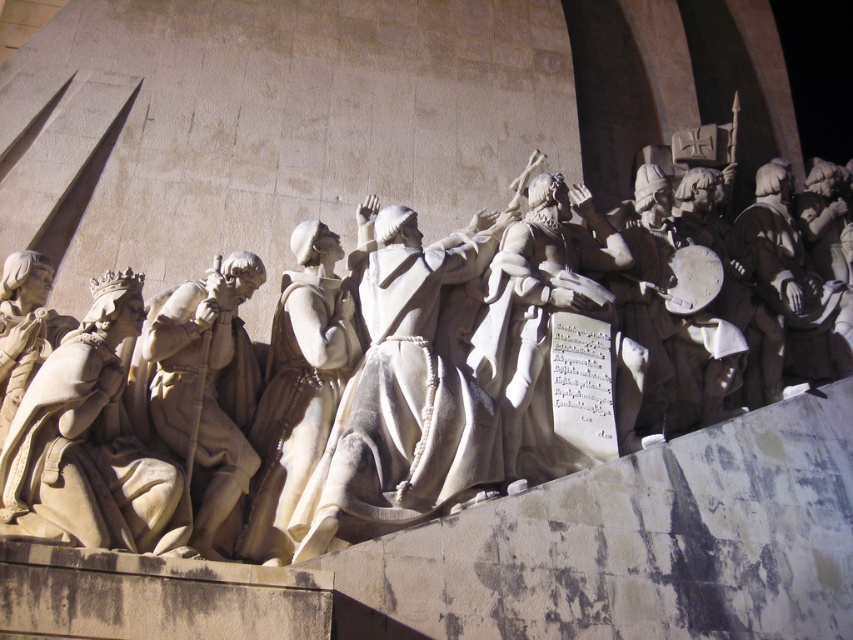
Question: Which is nearer to the beige stone statue at left?

Choices:
 (A) white marble statue at left
 (B) white stone statue at center

Answer: (A)

Question: Which of the following is the closest to the observer?

Choices:
 (A) white marble statue at left
 (B) white stone statue at center
 (C) beige stone statue at left

Answer: (B)

Question: Does white stone statue at center have a lesser width compared to beige stone statue at left?

Choices:
 (A) yes
 (B) no

Answer: (B)

Question: Is the position of white stone statue at center less distant than that of white marble statue at left?

Choices:
 (A) no
 (B) yes

Answer: (B)

Question: Among these objects, which one is farthest from the camera?

Choices:
 (A) white marble statue at left
 (B) beige stone statue at left
 (C) white stone statue at center

Answer: (A)

Question: Can you confirm if white stone statue at center is positioned above beige stone statue at left?

Choices:
 (A) no
 (B) yes

Answer: (B)